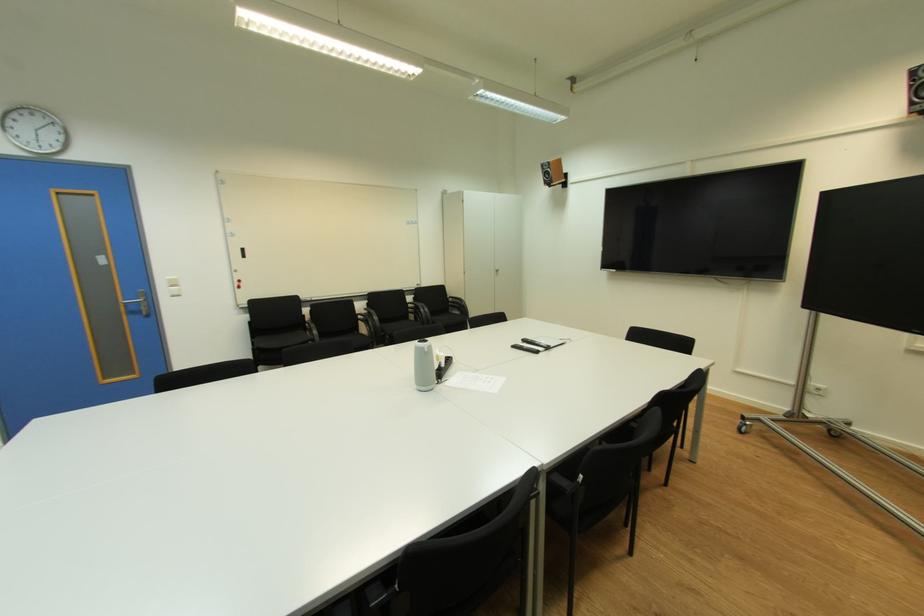
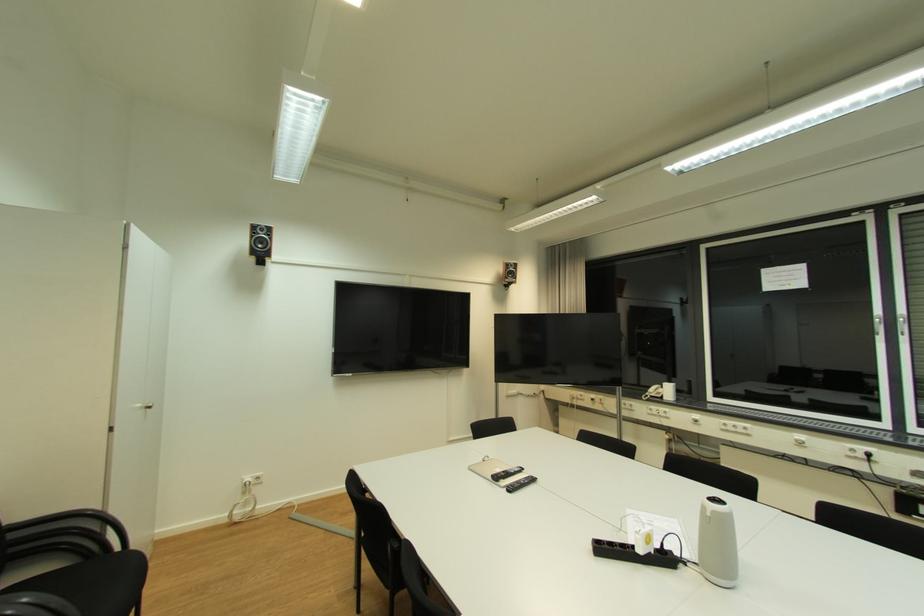
In the second image, find the point that corresponds to pixel 548 167 in the first image.

(261, 228)